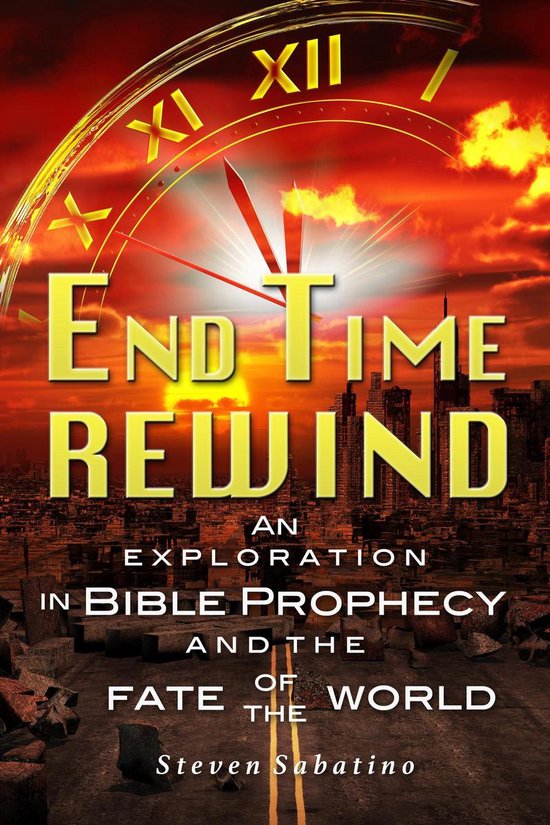
In order to click on trash in this screenshot , I will do `click(67, 545)`.